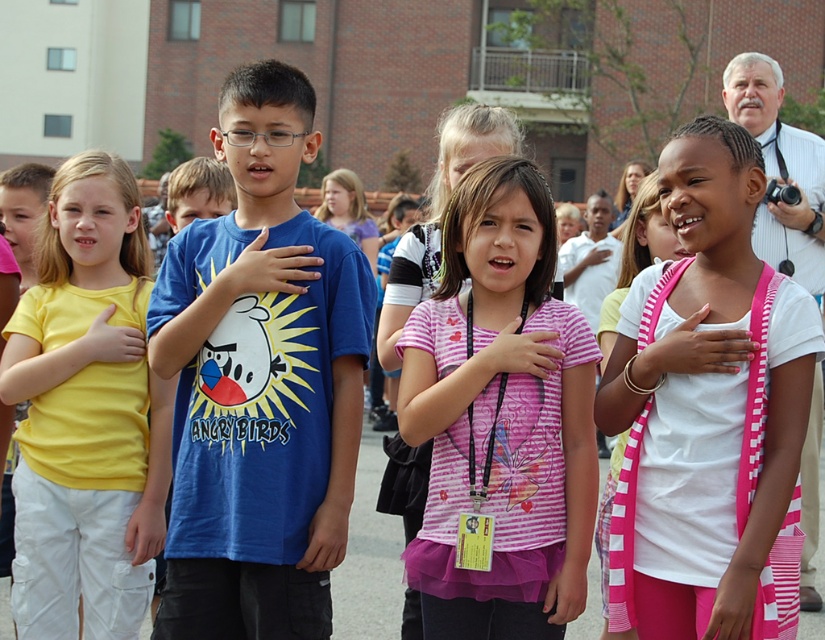
Does pink striped cardigan at center appear over yellow matte t-shirt at left?

Yes, pink striped cardigan at center is above yellow matte t-shirt at left.

Looking at this image, does pink striped cardigan at center have a greater height compared to yellow matte t-shirt at left?

No.

At what (x,y) coordinates should I click in order to perform the action: click on pink striped cardigan at center. Please return your answer as a coordinate pair (x, y). Looking at the image, I should click on (706, 401).

Does pink striped cardigan at center appear under pink striped shirt at center?

Actually, pink striped cardigan at center is above pink striped shirt at center.

Describe the element at coordinates (706, 401) in the screenshot. This screenshot has width=825, height=640. I see `pink striped cardigan at center` at that location.

The height and width of the screenshot is (640, 825). I want to click on pink striped cardigan at center, so click(x=706, y=401).

Find the location of a particular element. Image resolution: width=825 pixels, height=640 pixels. blue matte t-shirt at center is located at coordinates (260, 381).

Consider the image. Is blue matte t-shirt at center to the left of pink striped cardigan at center from the viewer's perspective?

Indeed, blue matte t-shirt at center is positioned on the left side of pink striped cardigan at center.

Does point (343, 428) come farther from viewer compared to point (611, 506)?

Yes, it is.

Where is `blue matte t-shirt at center`? Image resolution: width=825 pixels, height=640 pixels. blue matte t-shirt at center is located at coordinates (260, 381).